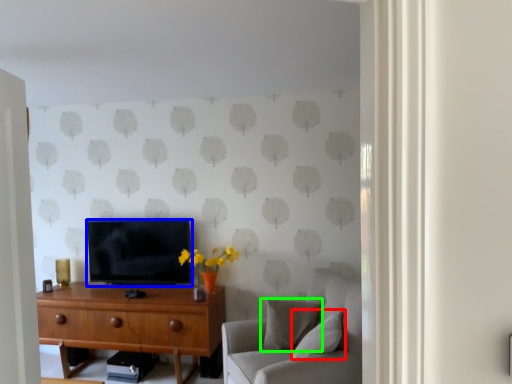
Question: Considering the real-world distances, which object is farthest from pillow (highlighted by a red box)? television (highlighted by a blue box) or pillow (highlighted by a green box)?

Choices:
 (A) television
 (B) pillow

Answer: (A)